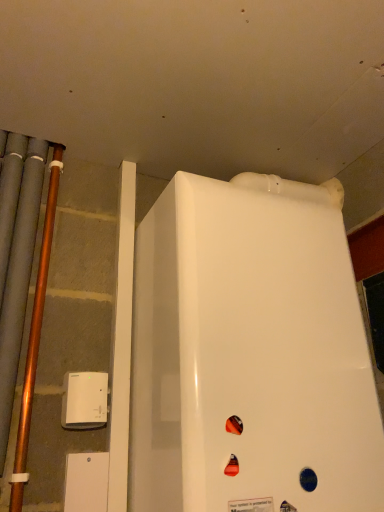
Question: Is white glossy refrigerator at center taller or shorter than copper metallic pipe at left?

Choices:
 (A) short
 (B) tall

Answer: (A)

Question: Relative to copper metallic pipe at left, is white glossy refrigerator at center in front or behind?

Choices:
 (A) front
 (B) behind

Answer: (A)

Question: Based on their relative distances, which object is farther from the copper metallic pipe at left?

Choices:
 (A) white plastic device at lower left
 (B) white glossy refrigerator at center

Answer: (B)

Question: Estimate the real-world distances between objects in this image. Which object is closer to the copper metallic pipe at left?

Choices:
 (A) white glossy refrigerator at center
 (B) white plastic device at lower left

Answer: (B)